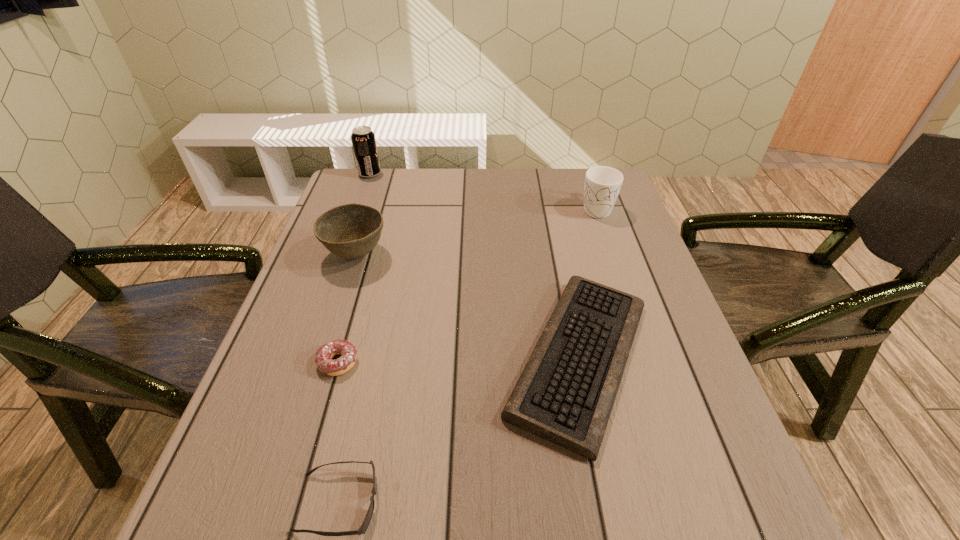
Find the location of `free location located 0.330m on the right of the doughnut`. free location located 0.330m on the right of the doughnut is located at coordinates (521, 362).

Find the location of a particular element. This screenshot has height=540, width=960. soda can at the far edge is located at coordinates (363, 139).

I want to click on mug at the far edge, so click(602, 185).

You are a GUI agent. You are given a task and a screenshot of the screen. Output one action in this format:
    pyautogui.click(x=<x>, y=<y>)
    Task: Click on the soda can at the left edge
    
    Given the screenshot: What is the action you would take?
    pyautogui.click(x=363, y=139)

Where is `bowl present at the left edge`? Image resolution: width=960 pixels, height=540 pixels. bowl present at the left edge is located at coordinates (351, 231).

The height and width of the screenshot is (540, 960). Find the location of `doughnut at the left edge`. doughnut at the left edge is located at coordinates (324, 355).

You are a GUI agent. You are given a task and a screenshot of the screen. Output one action in this format:
    pyautogui.click(x=<x>, y=<y>)
    Task: Click on the mug that is at the right edge
    
    Given the screenshot: What is the action you would take?
    pyautogui.click(x=602, y=185)

At what (x,y) coordinates should I click in order to perform the action: click on computer keyboard at the right edge. Please return your answer as a coordinate pair (x, y). The height and width of the screenshot is (540, 960). Looking at the image, I should click on (565, 394).

Image resolution: width=960 pixels, height=540 pixels. In order to click on object that is at the far left corner in this screenshot , I will do `click(363, 139)`.

Image resolution: width=960 pixels, height=540 pixels. In order to click on object that is at the far right corner in this screenshot , I will do `click(602, 185)`.